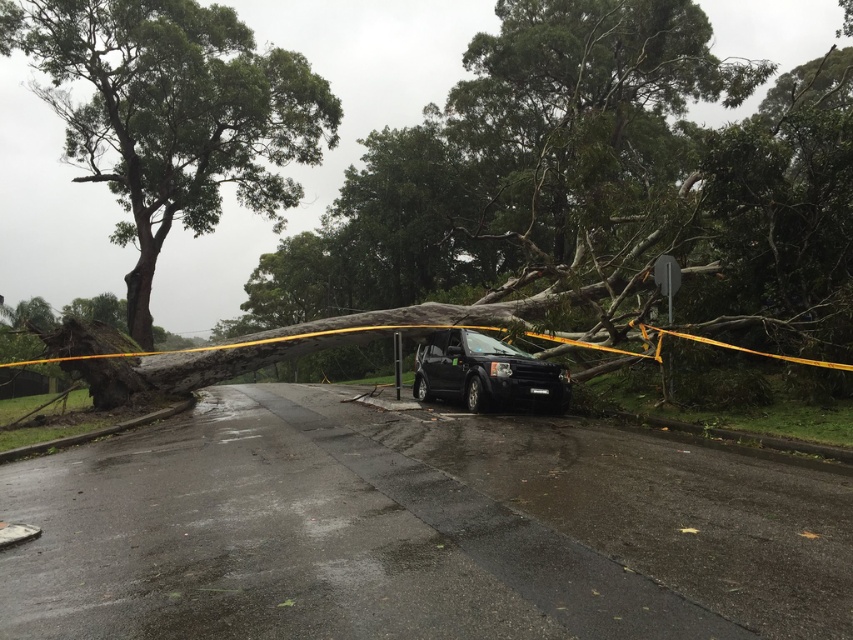
Question: Is dark gray bark tree at center positioned at the back of black matte suv at center?

Choices:
 (A) no
 (B) yes

Answer: (A)

Question: Does dark gray bark tree at center have a greater width compared to black matte suv at center?

Choices:
 (A) no
 (B) yes

Answer: (B)

Question: Among these points, which one is farthest from the camera?

Choices:
 (A) (259, 163)
 (B) (643, 102)
 (C) (422, 394)

Answer: (B)

Question: Considering the real-world distances, which object is closest to the green rough bark tree at upper left?

Choices:
 (A) dark gray bark tree at center
 (B) black matte suv at center

Answer: (A)

Question: From the image, what is the correct spatial relationship of green rough bark tree at upper left in relation to black matte suv at center?

Choices:
 (A) left
 (B) right

Answer: (A)

Question: Among these points, which one is nearest to the camera?

Choices:
 (A) (503, 392)
 (B) (239, 20)

Answer: (A)